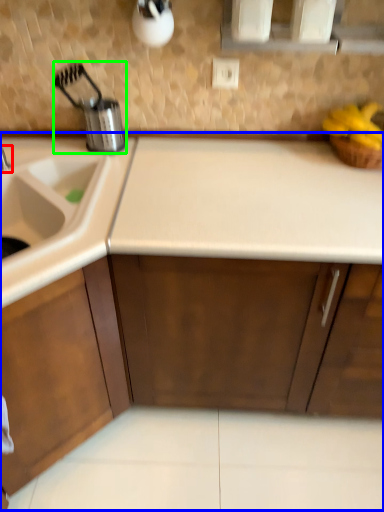
Question: Which object is positioned closest to tap (highlighted by a red box)? Select from countertop (highlighted by a blue box) and appliance (highlighted by a green box).

Choices:
 (A) countertop
 (B) appliance

Answer: (B)